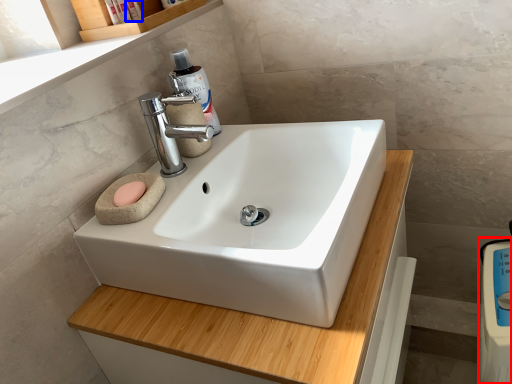
Question: Which object appears closest to the camera in this image, appliance (highlighted by a red box) or toiletry (highlighted by a blue box)?

Choices:
 (A) appliance
 (B) toiletry

Answer: (A)